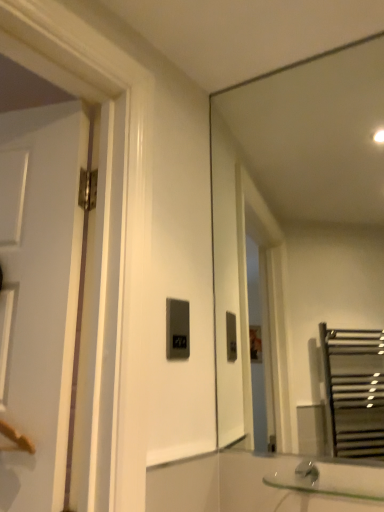
Question: From a real-world perspective, is clear glass sink at lower right above or below transparent glass mirror at upper right?

Choices:
 (A) above
 (B) below

Answer: (B)

Question: Choose the correct answer: Is clear glass sink at lower right inside transparent glass mirror at upper right or outside it?

Choices:
 (A) outside
 (B) inside

Answer: (A)

Question: Based on their relative distances, which object is farther from the clear glass sink at lower right?

Choices:
 (A) transparent glass mirror at upper right
 (B) matte black switch at center

Answer: (A)

Question: Considering the real-world distances, which object is farthest from the clear glass sink at lower right?

Choices:
 (A) transparent glass mirror at upper right
 (B) matte black switch at center

Answer: (A)